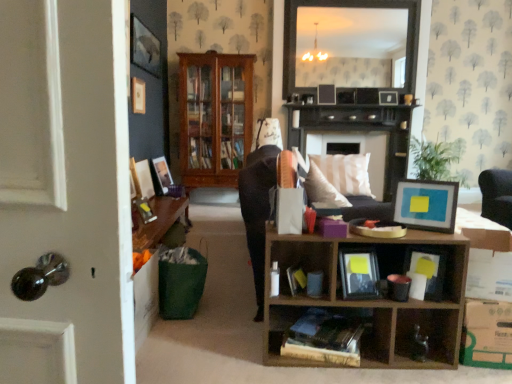
Locate an element on the screen. free space below matte black mirror at upper center (from a real-world perspective) is located at coordinates (337, 106).